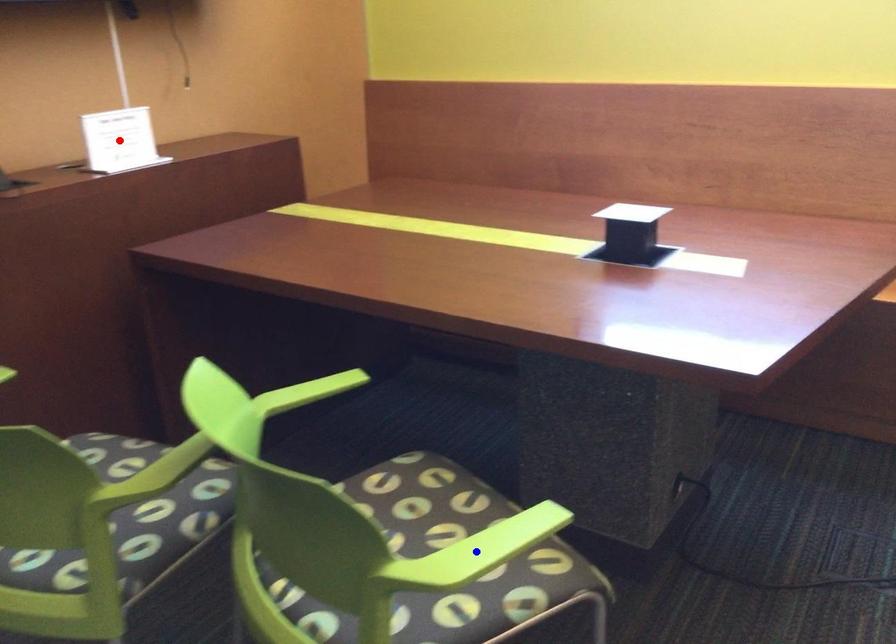
Question: Two points are marked on the image. Which point is closer to the camera?

Choices:
 (A) Blue point is closer.
 (B) Red point is closer.

Answer: (A)